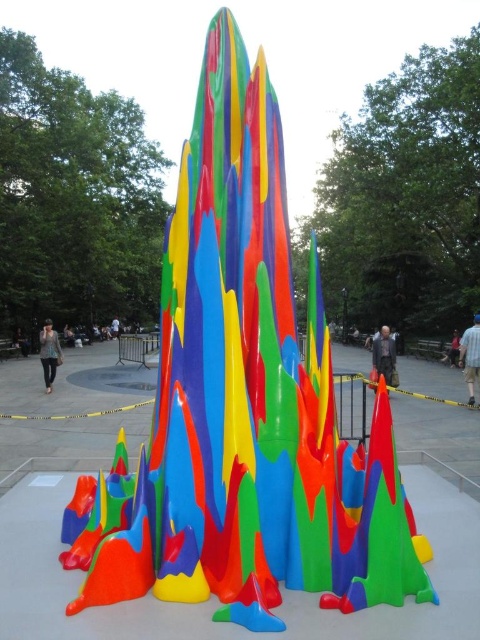
Question: Does matte black person at lower left appear on the right side of matte black person at center?

Choices:
 (A) no
 (B) yes

Answer: (A)

Question: Which point is closer to the camera taking this photo?

Choices:
 (A) (466, 332)
 (B) (112, 328)
 (C) (47, 387)
 (D) (377, 508)

Answer: (D)

Question: Is matte black person at lower left smaller than matte black person at center?

Choices:
 (A) yes
 (B) no

Answer: (B)

Question: Which of the following is the closest to the observer?

Choices:
 (A) matte black person at center
 (B) glossy plastic cone at center

Answer: (B)

Question: Can you confirm if glossy plastic cone at center is positioned to the left of matte black person at lower left?

Choices:
 (A) no
 (B) yes

Answer: (A)

Question: Considering the real-world distances, which object is farthest from the matte black person at lower left?

Choices:
 (A) denim jacket at lower left
 (B) glossy plastic cone at center
 (C) matte black jacket at upper center

Answer: (B)